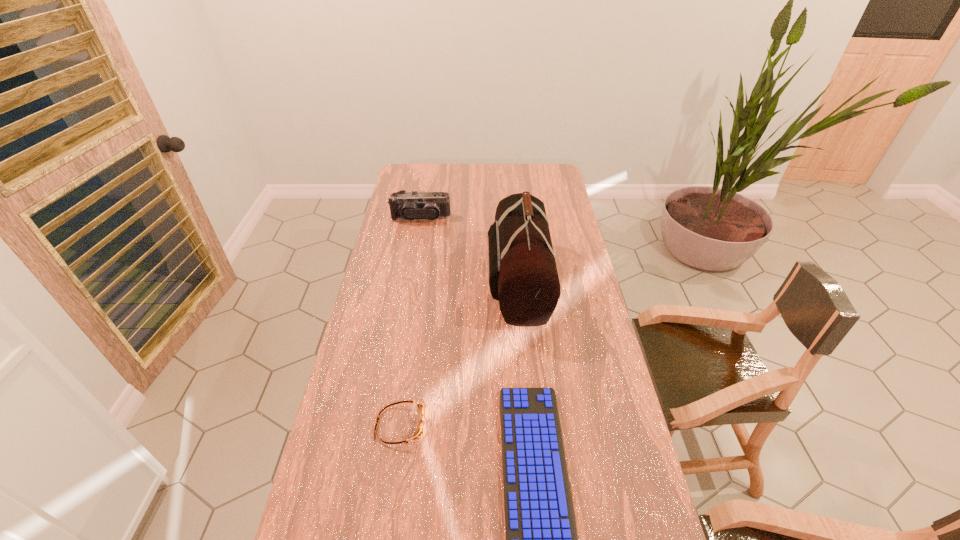
Image resolution: width=960 pixels, height=540 pixels. In order to click on camcorder located in the left edge section of the desktop in this screenshot , I will do `click(412, 205)`.

Find the location of a particular element. The height and width of the screenshot is (540, 960). goggles that is at the left edge is located at coordinates (420, 431).

Find the location of a particular element. The width and height of the screenshot is (960, 540). object located at the right edge is located at coordinates (523, 277).

You are a GUI agent. You are given a task and a screenshot of the screen. Output one action in this format:
    pyautogui.click(x=<x>, y=<y>)
    Task: Click on the vacant space at the far edge
    The height and width of the screenshot is (540, 960).
    Given the screenshot: What is the action you would take?
    pyautogui.click(x=492, y=168)

Where is `vacant region at the left edge`? The width and height of the screenshot is (960, 540). vacant region at the left edge is located at coordinates (381, 262).

Locate an element on the screen. Image resolution: width=960 pixels, height=540 pixels. vacant space at the right edge is located at coordinates (629, 530).

The image size is (960, 540). Identify the location of free region at the far right corner of the desktop. (561, 183).

Identify the location of empty space between the goggles and the duffel bag. This screenshot has height=540, width=960. (460, 353).

What are the coordinates of `free spot between the camcorder and the goggles` in the screenshot? It's located at (411, 321).

You are a GUI agent. You are given a task and a screenshot of the screen. Output one action in this format:
    pyautogui.click(x=<x>, y=<y>)
    Task: Click on the vacant region between the camcorder and the goggles
    
    Given the screenshot: What is the action you would take?
    pyautogui.click(x=411, y=321)